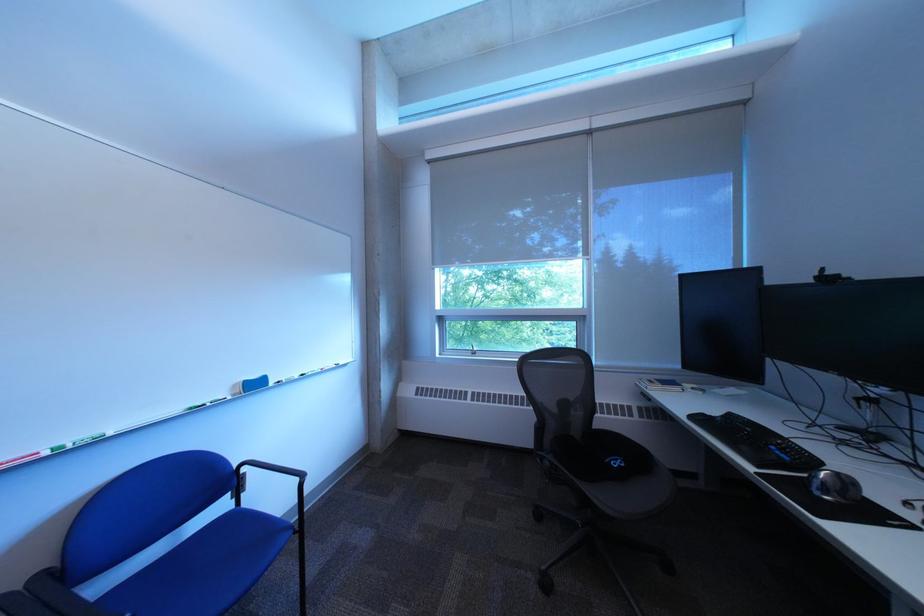
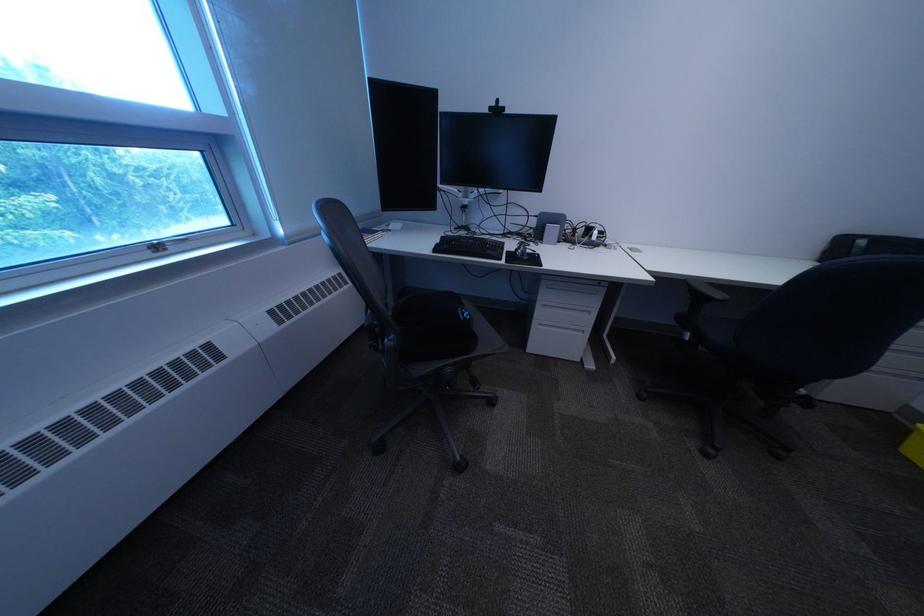
The point at (708, 419) is marked in the first image. Where is the corresponding point in the second image?

(451, 252)